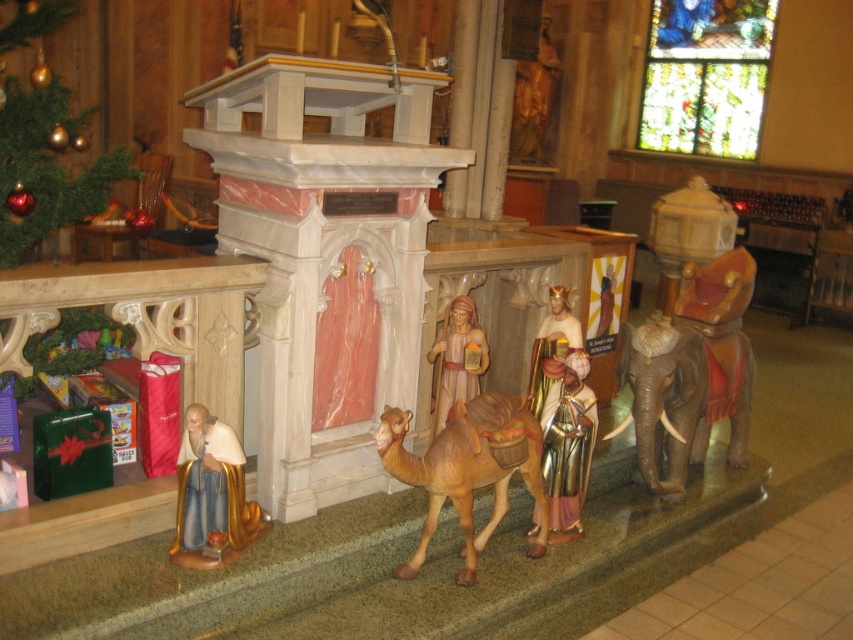
Looking at this image, you are standing in the church and want to place a gift on the lectern. The lectern is located at point 0.5, 0.5. Which direction should you move from the brown matte camel at center to reach the lectern?

To reach the lectern from the brown matte camel at center, you should move towards the northwest direction since the lectern is located at point [426,320], which is northwest of the camel at [467,468].

You are an art curator examining the nativity scene. You need to determine the vertical positioning of the gold glossy statue at lower left and the wooden figure at center. Which one is positioned lower in the image?

The gold glossy statue at lower left is positioned lower than the wooden figure at center because it is below it.

You are an interior designer planning to add a new shelf above the gold metallic figure at center and the wooden figure at center. Based on their positions, which figure will require the shelf to be placed higher to avoid blocking the view of the other?

The shelf should be placed higher to accommodate the wooden figure at center since it is positioned above the gold metallic figure at center, so placing the shelf above the wooden figure at center would ensure both are visible without obstruction.